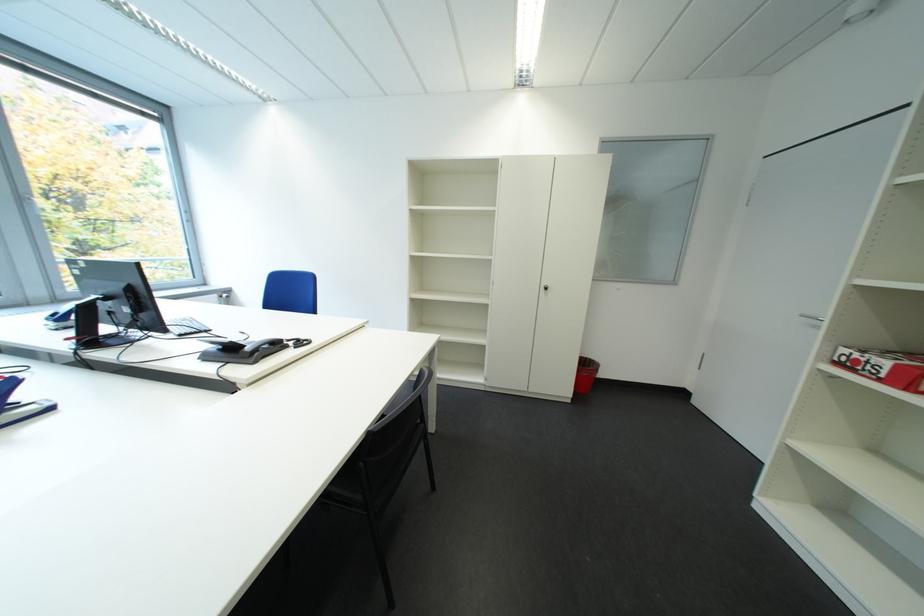
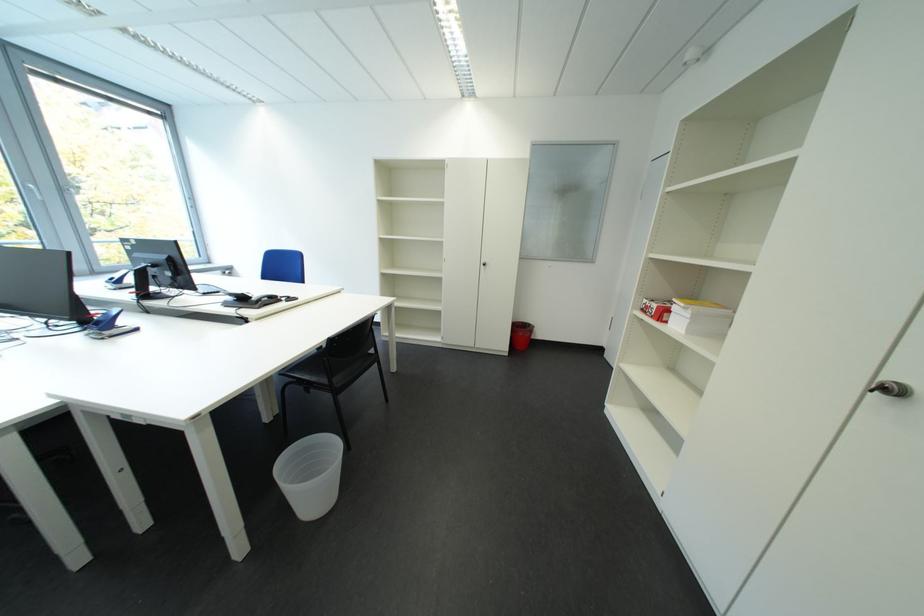
The images are taken continuously from a first-person perspective. In which direction are you moving?

The cameraman moved toward right, backward.